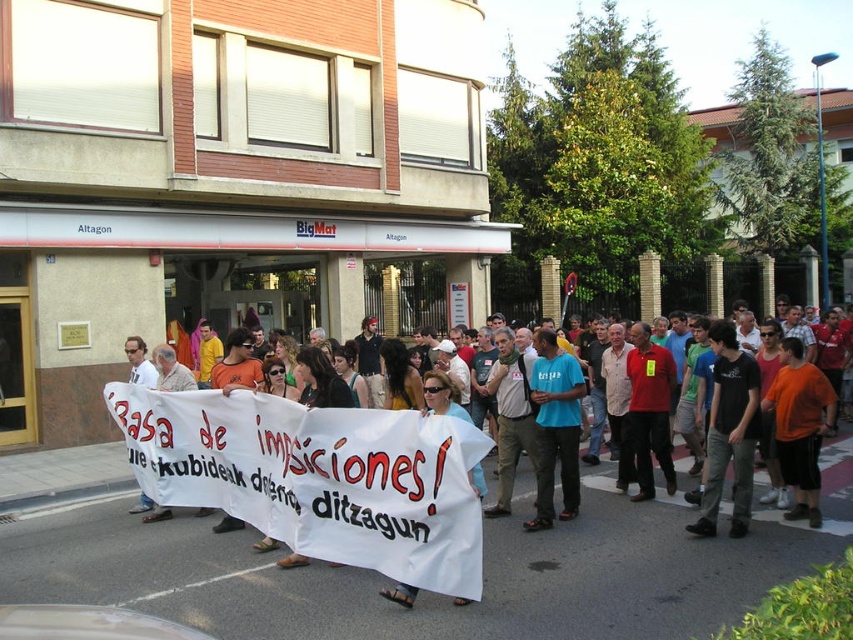
Which of these two, white fabric banner at center or blue t-shirt at center, stands taller?

Standing taller between the two is blue t-shirt at center.

Does white fabric banner at center come in front of blue t-shirt at center?

Yes, white fabric banner at center is in front of blue t-shirt at center.

Find the location of `white fabric banner at center`. white fabric banner at center is located at coordinates point(318,476).

Where is `white fabric banner at center`? white fabric banner at center is located at coordinates (318, 476).

Image resolution: width=853 pixels, height=640 pixels. What do you see at coordinates (318, 476) in the screenshot? I see `white fabric banner at center` at bounding box center [318, 476].

The image size is (853, 640). I want to click on white fabric banner at center, so click(318, 476).

Does orange cotton shirt at center appear under blue t-shirt at center?

Correct, orange cotton shirt at center is located below blue t-shirt at center.

Can you confirm if orange cotton shirt at center is taller than blue t-shirt at center?

Incorrect, orange cotton shirt at center's height is not larger of blue t-shirt at center's.

Who is more forward, (780, 387) or (544, 368)?

Positioned in front is point (780, 387).

This screenshot has width=853, height=640. Find the location of `orange cotton shirt at center`. orange cotton shirt at center is located at coordinates (799, 426).